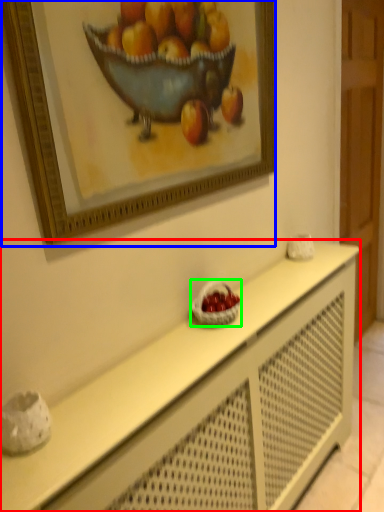
Question: Based on their relative distances, which object is farther from table (highlighted by a red box)? Choose from picture frame (highlighted by a blue box) and basket (highlighted by a green box).

Choices:
 (A) picture frame
 (B) basket

Answer: (A)